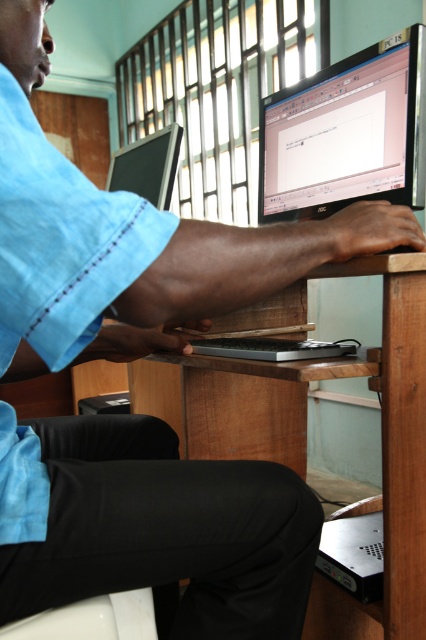
You have a small toy car that is 5 inches long. You want to place it between the wooden at center and the silver metallic laptop at center on the desk. Will it fit without overlapping either object?

The wooden at center and silver metallic laptop at center are 5.75 inches apart. Since the toy car is 5 inches long, it will fit between them without overlapping either object.